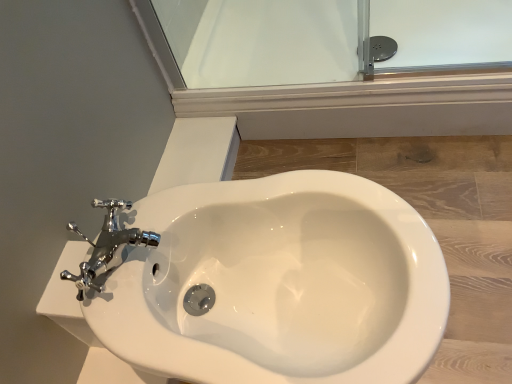
Question: Is chrome metallic faucet at upper left positioned behind white glossy bidet at center?

Choices:
 (A) no
 (B) yes

Answer: (B)

Question: Is chrome metallic faucet at upper left positioned with its back to white glossy bidet at center?

Choices:
 (A) no
 (B) yes

Answer: (A)

Question: From the image's perspective, is chrome metallic faucet at upper left below white glossy bidet at center?

Choices:
 (A) no
 (B) yes

Answer: (A)

Question: Does chrome metallic faucet at upper left appear on the left side of white glossy bidet at center?

Choices:
 (A) yes
 (B) no

Answer: (A)

Question: Is chrome metallic faucet at upper left wider than white glossy bidet at center?

Choices:
 (A) no
 (B) yes

Answer: (A)

Question: Considering the relative sizes of chrome metallic faucet at upper left and white glossy bidet at center in the image provided, is chrome metallic faucet at upper left taller than white glossy bidet at center?

Choices:
 (A) yes
 (B) no

Answer: (B)

Question: Considering the relative sizes of chrome metallic faucet at upper left and transparent glass door at upper center in the image provided, is chrome metallic faucet at upper left wider than transparent glass door at upper center?

Choices:
 (A) no
 (B) yes

Answer: (A)

Question: Is chrome metallic faucet at upper left with transparent glass door at upper center?

Choices:
 (A) yes
 (B) no

Answer: (B)

Question: Considering the relative sizes of chrome metallic faucet at upper left and transparent glass door at upper center in the image provided, is chrome metallic faucet at upper left thinner than transparent glass door at upper center?

Choices:
 (A) yes
 (B) no

Answer: (A)

Question: Is chrome metallic faucet at upper left not within transparent glass door at upper center?

Choices:
 (A) yes
 (B) no

Answer: (A)

Question: Does chrome metallic faucet at upper left appear on the left side of transparent glass door at upper center?

Choices:
 (A) no
 (B) yes

Answer: (B)

Question: From the image's perspective, is chrome metallic faucet at upper left on top of transparent glass door at upper center?

Choices:
 (A) yes
 (B) no

Answer: (B)

Question: Considering the relative sizes of white glossy bidet at center and transparent glass door at upper center in the image provided, is white glossy bidet at center thinner than transparent glass door at upper center?

Choices:
 (A) no
 (B) yes

Answer: (B)